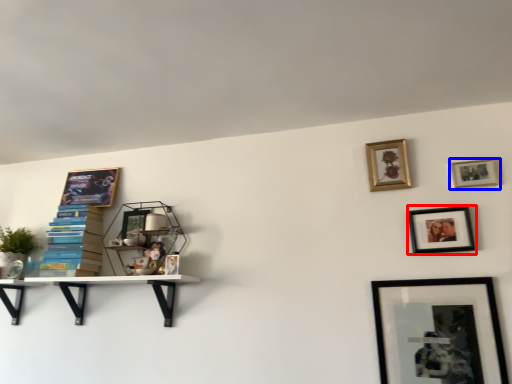
Question: Which point is further to the camera, picture frame (highlighted by a red box) or picture frame (highlighted by a blue box)?

Choices:
 (A) picture frame
 (B) picture frame

Answer: (B)